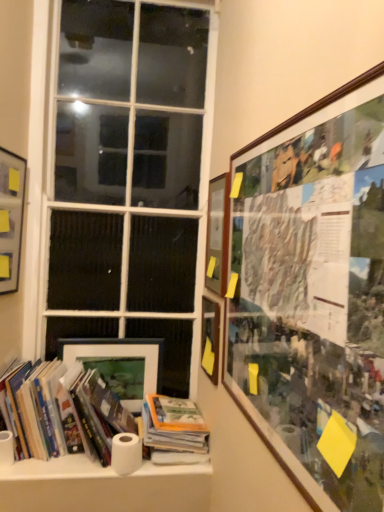
Question: From the image's perspective, is white matte toilet paper at lower center below wooden picture frame at upper right, the 4th picture frame when ordered from left to right?

Choices:
 (A) no
 (B) yes

Answer: (B)

Question: Can you confirm if white matte toilet paper at lower center is thinner than wooden picture frame at upper right, the 2th picture frame when ordered from right to left?

Choices:
 (A) no
 (B) yes

Answer: (A)

Question: Considering the relative sizes of white matte toilet paper at lower center and wooden picture frame at upper right, the 4th picture frame when ordered from left to right, in the image provided, is white matte toilet paper at lower center bigger than wooden picture frame at upper right, the 4th picture frame when ordered from left to right,?

Choices:
 (A) yes
 (B) no

Answer: (B)

Question: From the image's perspective, is white matte toilet paper at lower center on wooden picture frame at upper right, the 4th picture frame when ordered from left to right?

Choices:
 (A) no
 (B) yes

Answer: (A)

Question: From a real-world perspective, is white matte toilet paper at lower center below wooden picture frame at upper right, the 4th picture frame when ordered from left to right?

Choices:
 (A) no
 (B) yes

Answer: (B)

Question: Is white matte toilet paper at lower center smaller than wooden picture frame at upper right, the 4th picture frame when ordered from left to right?

Choices:
 (A) yes
 (B) no

Answer: (A)

Question: Can you confirm if hardcover book at center, marked as the 2th book in a left-to-right arrangement, is taller than matte black picture frame at lower left, placed as the 4th picture frame when sorted from right to left?

Choices:
 (A) no
 (B) yes

Answer: (A)

Question: Does hardcover book at center, marked as the 2th book in a left-to-right arrangement, appear on the left side of matte black picture frame at lower left, placed as the 4th picture frame when sorted from right to left?

Choices:
 (A) no
 (B) yes

Answer: (A)

Question: Is hardcover book at center, marked as the 2th book in a left-to-right arrangement, touching matte black picture frame at lower left, placed as the 4th picture frame when sorted from right to left?

Choices:
 (A) yes
 (B) no

Answer: (B)

Question: Could matte black picture frame at lower left, placed as the 4th picture frame when sorted from right to left, be considered to be inside hardcover book at center, the 1th book when ordered from right to left?

Choices:
 (A) yes
 (B) no

Answer: (B)

Question: Does hardcover book at center, marked as the 2th book in a left-to-right arrangement, have a lesser height compared to matte black picture frame at lower left, placed as the 4th picture frame when sorted from right to left?

Choices:
 (A) yes
 (B) no

Answer: (A)

Question: From a real-world perspective, is hardcover book at center, the 1th book when ordered from right to left, physically above matte black picture frame at lower left, placed as the 4th picture frame when sorted from right to left?

Choices:
 (A) yes
 (B) no

Answer: (B)

Question: From the image's perspective, is white matte paper towel at lower left beneath hardcover book at center, the 1th book when ordered from right to left?

Choices:
 (A) no
 (B) yes

Answer: (A)